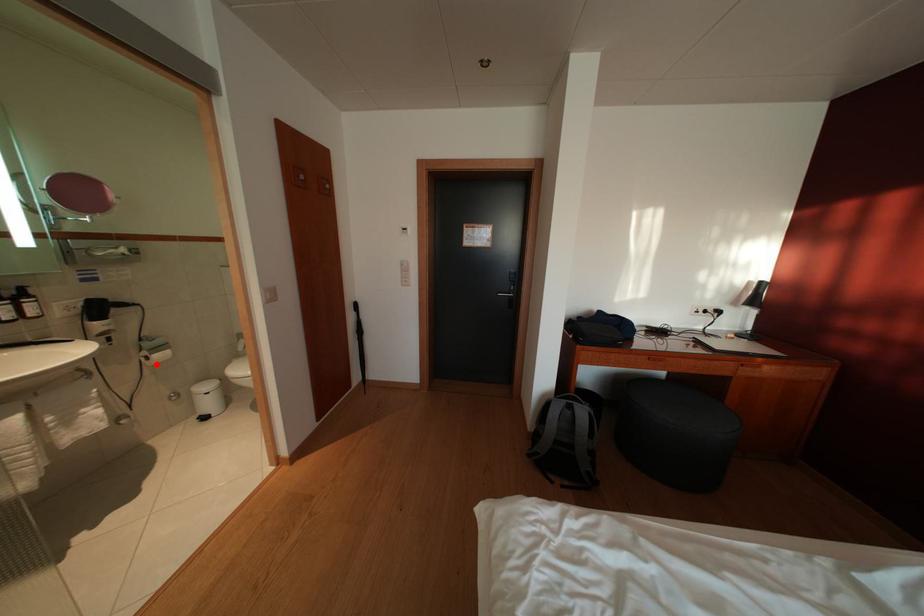
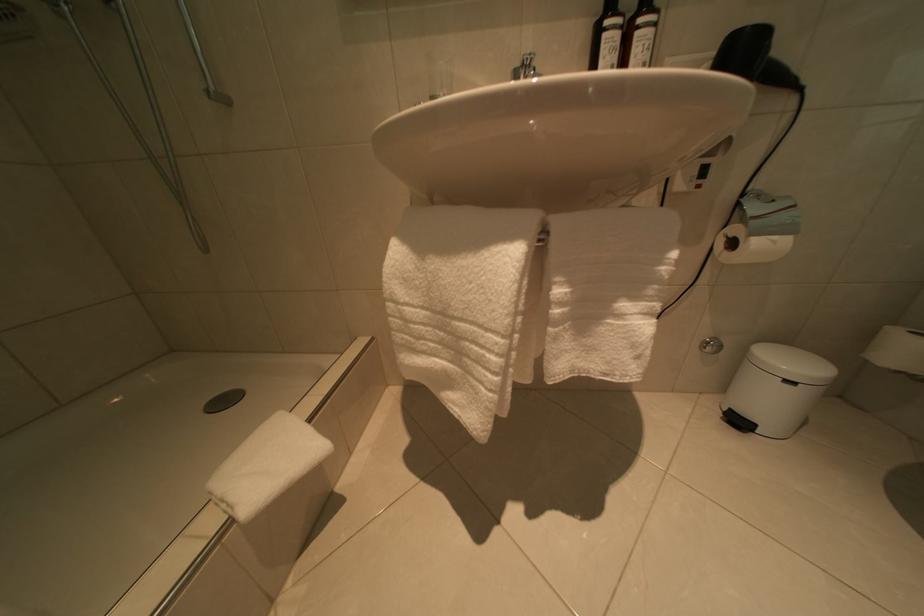
The point at the highlighted location is marked in the first image. Where is the corresponding point in the second image?

(740, 249)